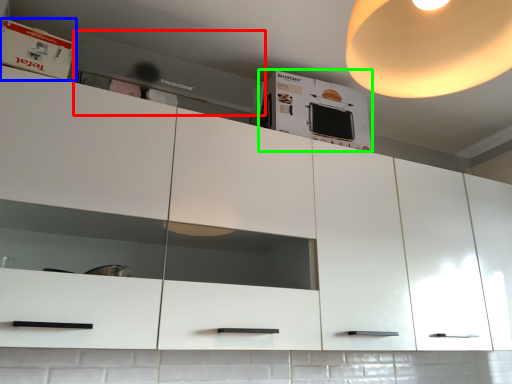
Question: Based on their relative distances, which object is nearer to home appliance (highlighted by a red box)? Choose from cabinet (highlighted by a blue box) and cabinetry (highlighted by a green box).

Choices:
 (A) cabinet
 (B) cabinetry

Answer: (B)